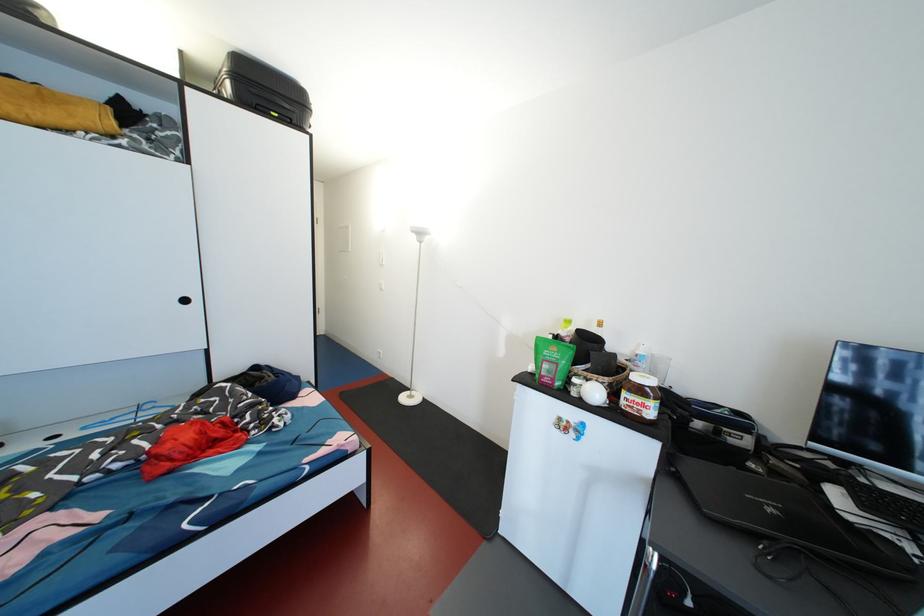
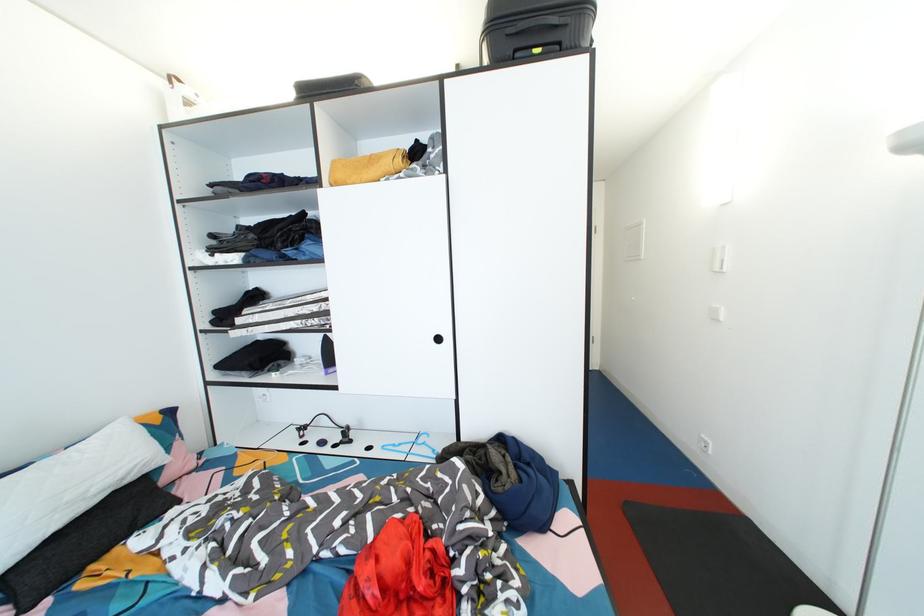
The point at (419, 237) is marked in the first image. Where is the corresponding point in the second image?

(913, 152)